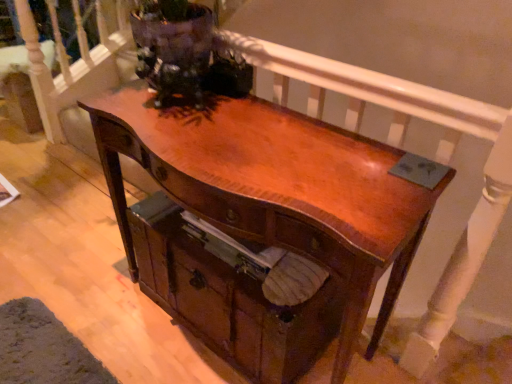
This screenshot has height=384, width=512. Identify the location of free location to the left of wooden drawer at center. (99, 311).